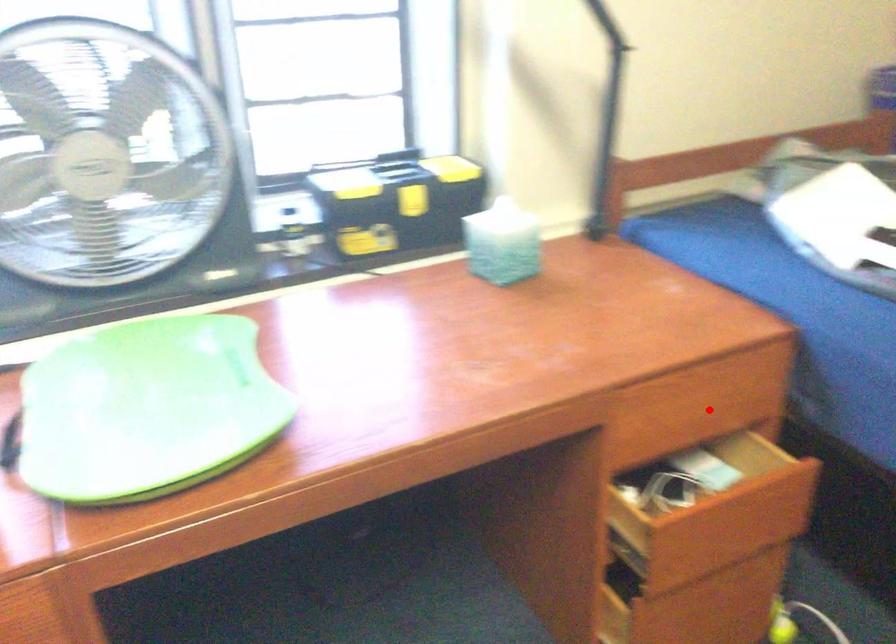
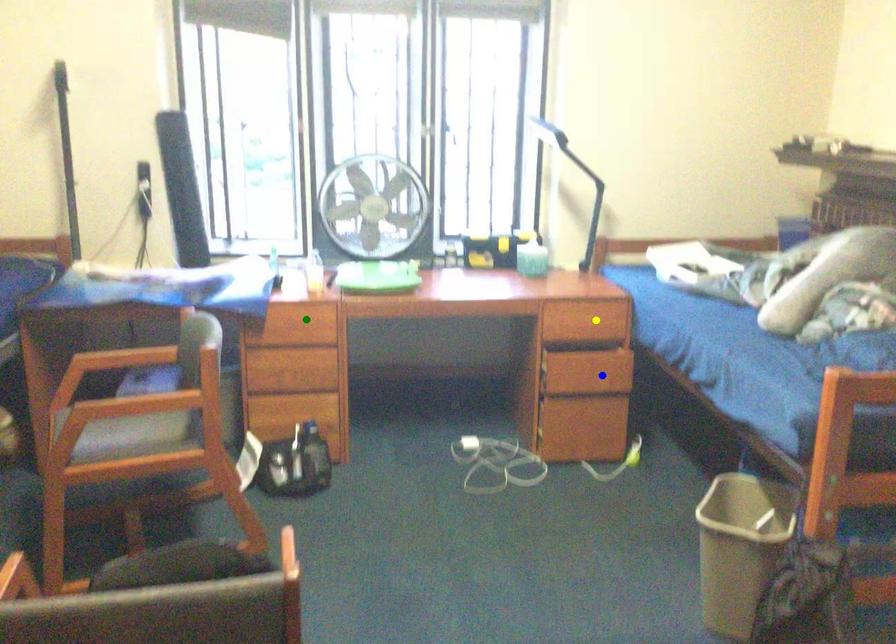
Question: I am providing you with two images of the same scene from different viewpoints. A red point is marked on the first image. You are given multiple points on the second image. Which mark in image 2 goes with the point in image 1?

Choices:
 (A) green point
 (B) yellow point
 (C) blue point

Answer: (B)